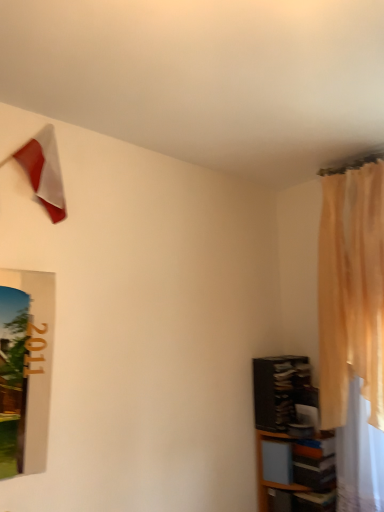
Question: Can you confirm if light beige sheer curtain at right is wider than matte red flag at upper left?

Choices:
 (A) no
 (B) yes

Answer: (B)

Question: Considering the relative positions of light beige sheer curtain at right and matte red flag at upper left in the image provided, is light beige sheer curtain at right to the right of matte red flag at upper left from the viewer's perspective?

Choices:
 (A) yes
 (B) no

Answer: (A)

Question: Is the position of light beige sheer curtain at right less distant than that of matte red flag at upper left?

Choices:
 (A) no
 (B) yes

Answer: (A)

Question: Is light beige sheer curtain at right far away from matte red flag at upper left?

Choices:
 (A) yes
 (B) no

Answer: (A)

Question: Can you confirm if light beige sheer curtain at right is taller than matte red flag at upper left?

Choices:
 (A) no
 (B) yes

Answer: (B)

Question: From the image's perspective, would you say light beige sheer curtain at right is shown under matte red flag at upper left?

Choices:
 (A) yes
 (B) no

Answer: (A)

Question: Would you say matte red flag at upper left contains light beige sheer curtain at right?

Choices:
 (A) yes
 (B) no

Answer: (B)

Question: Is matte red flag at upper left not close to light beige sheer curtain at right?

Choices:
 (A) yes
 (B) no

Answer: (A)

Question: Can you confirm if matte red flag at upper left is bigger than light beige sheer curtain at right?

Choices:
 (A) no
 (B) yes

Answer: (A)

Question: Is matte red flag at upper left oriented away from light beige sheer curtain at right?

Choices:
 (A) no
 (B) yes

Answer: (A)

Question: Could you tell me if matte red flag at upper left is facing light beige sheer curtain at right?

Choices:
 (A) yes
 (B) no

Answer: (B)

Question: Considering the relative sizes of matte red flag at upper left and light beige sheer curtain at right in the image provided, is matte red flag at upper left wider than light beige sheer curtain at right?

Choices:
 (A) no
 (B) yes

Answer: (A)

Question: Would you say black glossy shelf at lower right, placed as the 1th shelf when sorted from top to bottom, contains wooden shelf at lower right, the 1th shelf from the bottom?

Choices:
 (A) yes
 (B) no

Answer: (B)